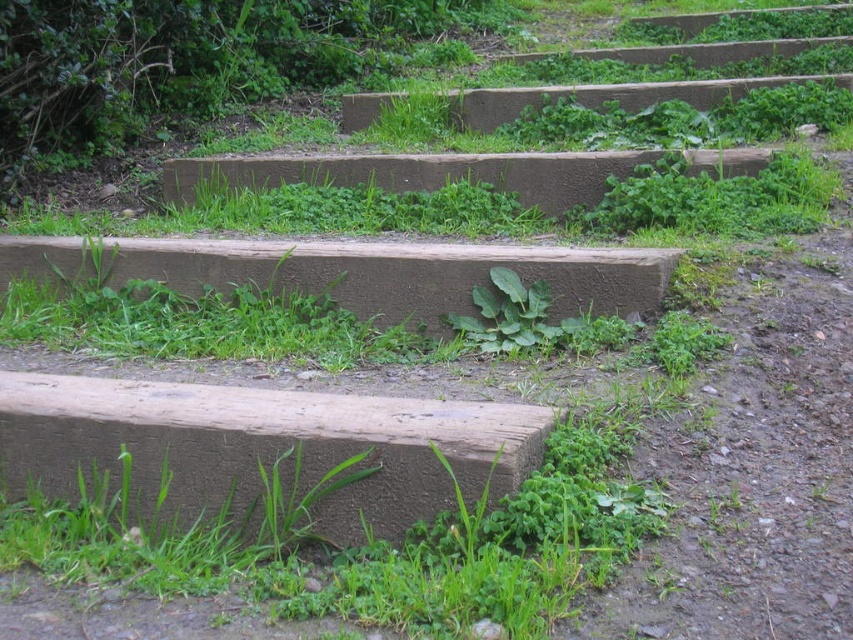
Question: Is brown rough concrete at lower left positioned before green leafy plant at center?

Choices:
 (A) no
 (B) yes

Answer: (B)

Question: Which point is closer to the camera?

Choices:
 (A) (57, 499)
 (B) (489, 269)

Answer: (A)

Question: Which point appears closest to the camera in this image?

Choices:
 (A) (476, 253)
 (B) (177, 442)

Answer: (B)

Question: Is brown rough concrete at lower left further to camera compared to brown rough concrete at center?

Choices:
 (A) yes
 (B) no

Answer: (B)

Question: Can you confirm if brown rough concrete at center is bigger than green leafy plant at center?

Choices:
 (A) yes
 (B) no

Answer: (A)

Question: Which point appears closest to the camera in this image?

Choices:
 (A) (485, 292)
 (B) (273, 276)
 (C) (299, 445)

Answer: (C)